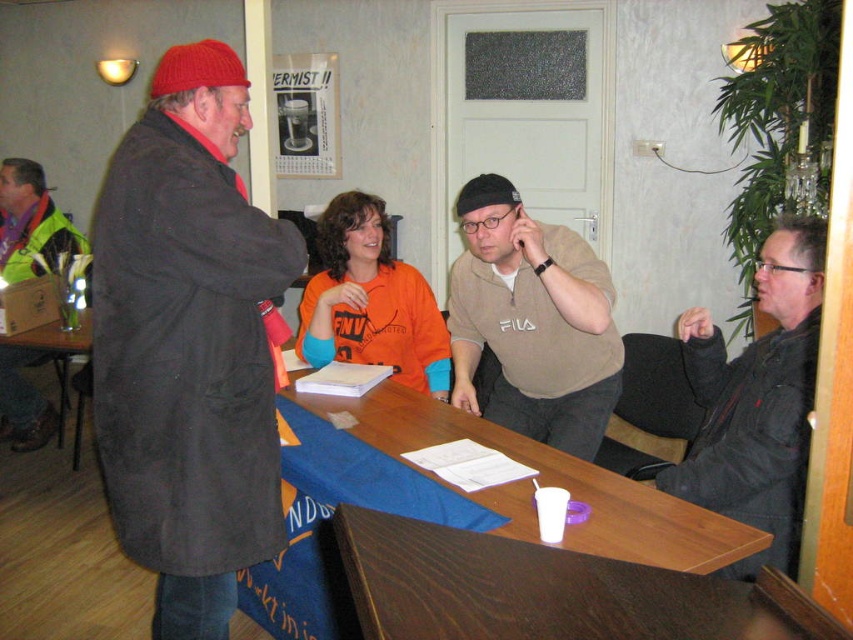
You are standing in the room and want to greet both the person wearing the beige cotton shirt at center and the person wearing the black leather jacket at right. Which person should you approach first to reach them more quickly?

You should approach the beige cotton shirt at center first because it is closer to you than the black leather jacket at right, so you can reach them more quickly.

Based on the photo, you are organizing a small event and need to place an 80 cm wide banner on the wooden table at center. Given that the orange cotton shirt at center is currently on the table, can the banner fit on the table?

The wooden table at center is wider than the orange cotton shirt at center. Since the orange cotton shirt at center is on the table, the table must be wider than the shirt. However, without knowing the exact width of the table itself, we cannot confirm if the 80 cm banner will fit. Please measure the table first.